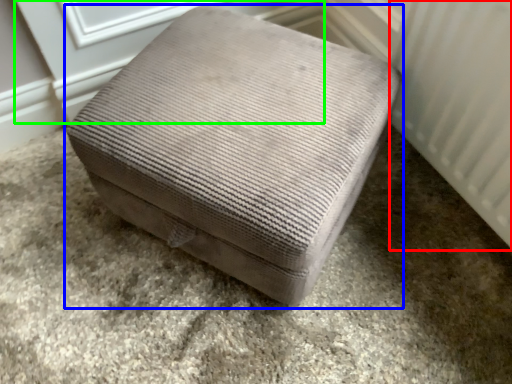
Question: Considering the real-world distances, which object is farthest from radiator (highlighted by a red box)? furniture (highlighted by a blue box) or screen door (highlighted by a green box)?

Choices:
 (A) furniture
 (B) screen door

Answer: (B)